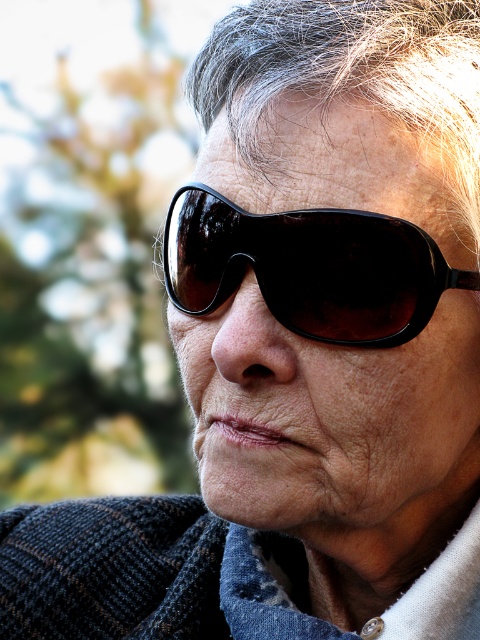
You are taking a photo and want to ensure that both point (119, 625) and point (356, 280) are in focus. Given the background is blurred, which point is closer to the camera and should be focused on first?

Point (356, 280) is closer to the camera since it is in front of point (119, 625), which is behind it. Focus on point (356, 280) first to ensure both are in focus.

You are a photographer trying to adjust the lighting in the scene. You need to place a reflector to the right of the black plastic sunglasses at center. Will the faded denim jacket at lower right interfere with the placement?

The faded denim jacket at lower right is to the left of the black plastic sunglasses at center, so placing the reflector to the right of the sunglasses would not be blocked by the jacket.

You are a photographer trying to adjust the lighting for a portrait. You notice the faded denim jacket at lower right and the black plastic sunglasses at center. Which object is positioned lower in the frame?

The faded denim jacket at lower right is located below the black plastic sunglasses at center, so it is positioned lower in the frame.